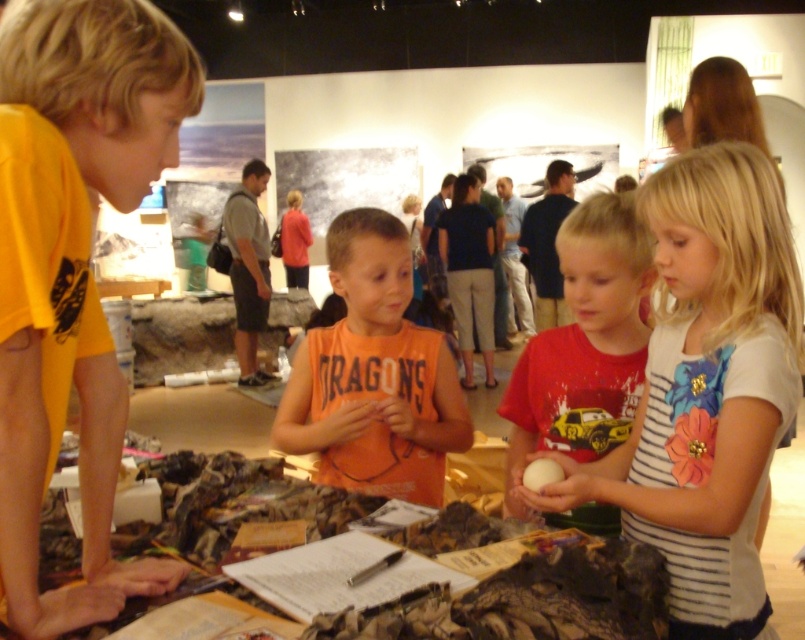
Does white matte egg at center have a lesser width compared to orange cotton shirt at center?

Incorrect, white matte egg at center's width is not less than orange cotton shirt at center's.

Who is shorter, white matte egg at center or orange cotton shirt at center?

white matte egg at center

Image resolution: width=805 pixels, height=640 pixels. I want to click on white matte egg at center, so pos(510,586).

Can you confirm if yellow matte shirt at left is positioned above orange cotton shirt at center?

Correct, yellow matte shirt at left is located above orange cotton shirt at center.

Who is higher up, yellow matte shirt at left or orange cotton shirt at center?

yellow matte shirt at left

In order to click on yellow matte shirt at left in this screenshot , I will do `click(73, 275)`.

Locate an element on the screen. The width and height of the screenshot is (805, 640). yellow matte shirt at left is located at coordinates (73, 275).

Which is in front, point (5, 499) or point (486, 621)?

Point (5, 499)

Which is behind, point (0, 172) or point (471, 628)?

The point (471, 628) is more distant.

Locate an element on the screen. The height and width of the screenshot is (640, 805). yellow matte shirt at left is located at coordinates (73, 275).